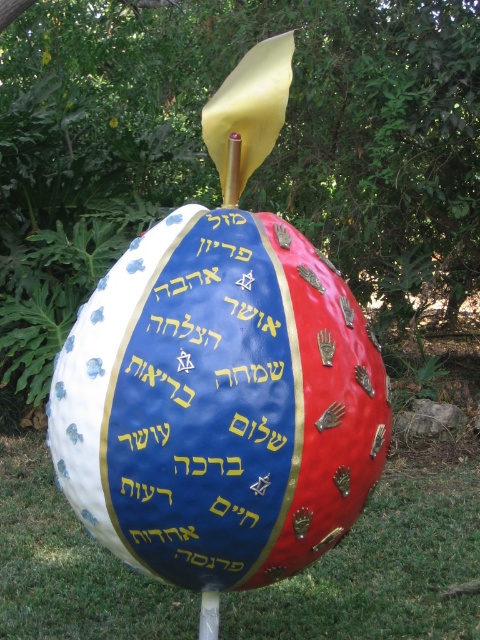
Does point (229, 566) come behind point (338, 614)?

No, (229, 566) is closer to viewer.

Between gold metallic hebrew words at center and green grass at center, which one has more height?

Standing taller between the two is gold metallic hebrew words at center.

Locate an element on the screen. Image resolution: width=480 pixels, height=640 pixels. gold metallic hebrew words at center is located at coordinates (205, 412).

Does glossy metallic sphere at center appear under gold metallic hebrew words at center?

No.

Does glossy metallic sphere at center appear over gold metallic hebrew words at center?

Yes.

What do you see at coordinates (218, 403) in the screenshot? This screenshot has height=640, width=480. I see `glossy metallic sphere at center` at bounding box center [218, 403].

Identify the location of glossy metallic sphere at center. (218, 403).

Who is lower down, gold metallic hebrew words at center or metallic silver pole at center?

metallic silver pole at center is lower down.

Identify the location of gold metallic hebrew words at center. (205, 412).

Who is more forward, (214, 358) or (208, 598)?

Point (214, 358)

Identify the location of gold metallic hebrew words at center. (205, 412).